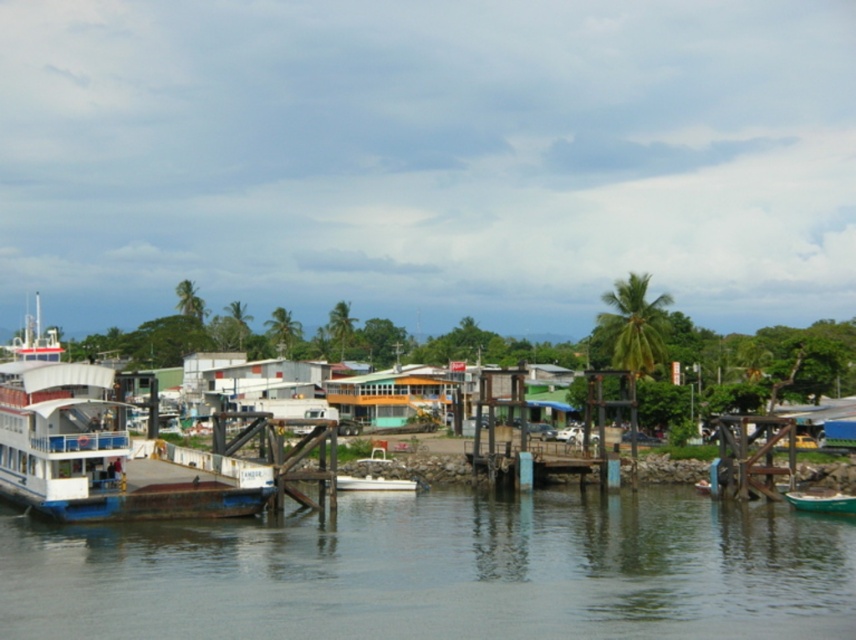
Does point (31, 451) lie behind point (792, 499)?

No, it is in front of (792, 499).

Between point (140, 493) and point (819, 506), which one is positioned in front?

Point (140, 493) is in front.

Between point (103, 381) and point (798, 497), which one is positioned behind?

The point (798, 497) is more distant.

Image resolution: width=856 pixels, height=640 pixels. I want to click on white matte boat at left, so click(x=100, y=448).

Is white matte boat at left further to the viewer compared to wooden dock at center-right?

No, white matte boat at left is in front of wooden dock at center-right.

Does white matte boat at left have a lesser width compared to wooden dock at center-right?

No.

This screenshot has width=856, height=640. I want to click on white matte boat at left, so click(100, 448).

You are a GUI agent. You are given a task and a screenshot of the screen. Output one action in this format:
    pyautogui.click(x=<x>, y=<y>)
    Task: Click on the white matte boat at left
    
    Given the screenshot: What is the action you would take?
    pyautogui.click(x=100, y=448)

Does point (49, 422) come behind point (409, 481)?

No.

This screenshot has height=640, width=856. What do you see at coordinates (100, 448) in the screenshot? I see `white matte boat at left` at bounding box center [100, 448].

Identify the location of white matte boat at left. The image size is (856, 640). (100, 448).